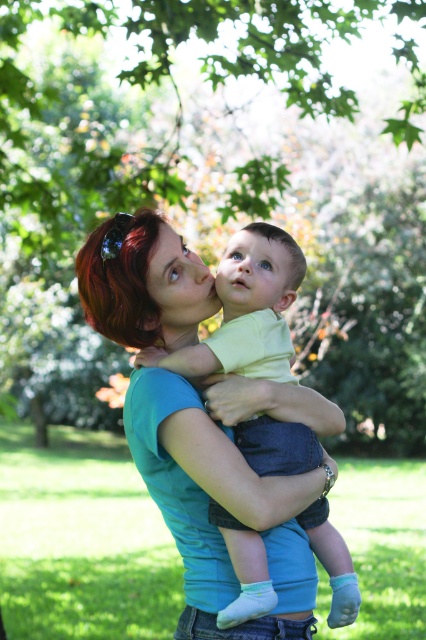
Does point (187, 374) come closer to viewer compared to point (267, 224)?

Yes, it is.

Which is behind, point (276, 428) or point (294, 246)?

Positioned behind is point (294, 246).

What do you see at coordinates (259, 294) in the screenshot? I see `light yellow fabric baby at center` at bounding box center [259, 294].

Where is `light yellow fabric baby at center`? The height and width of the screenshot is (640, 426). light yellow fabric baby at center is located at coordinates (259, 294).

Does green leafy tree at upper center have a lesser width compared to blue smooth forehead at center?

No.

Is point (356, 412) closer to camera compared to point (285, 234)?

That is False.

Who is more distant from viewer, (5,120) or (270,227)?

The point (5,120) is behind.

Locate an element on the screen. green leafy tree at upper center is located at coordinates (215, 186).

Find the location of a particular element. green leafy tree at upper center is located at coordinates (215, 186).

Looking at this image, can you confirm if green leafy tree at upper center is taller than light yellow fabric baby at center?

Yes, green leafy tree at upper center is taller than light yellow fabric baby at center.

Locate an element on the screen. The width and height of the screenshot is (426, 640). green leafy tree at upper center is located at coordinates (215, 186).